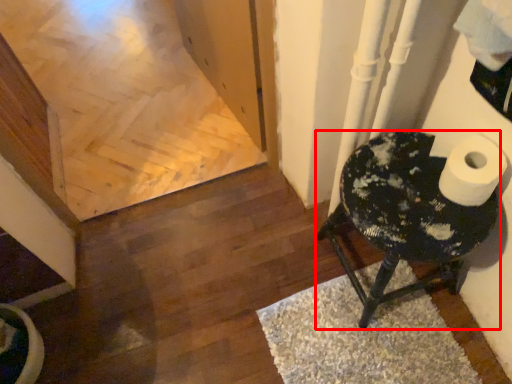
Question: Observing the image, what is the correct spatial positioning of furniture (annotated by the red box) in reference to doormat?

Choices:
 (A) left
 (B) right

Answer: (B)